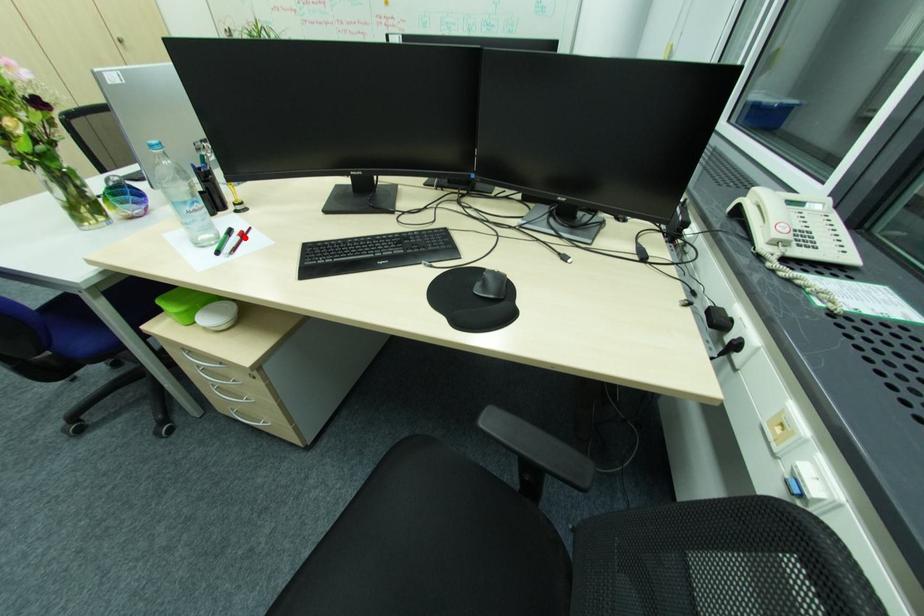
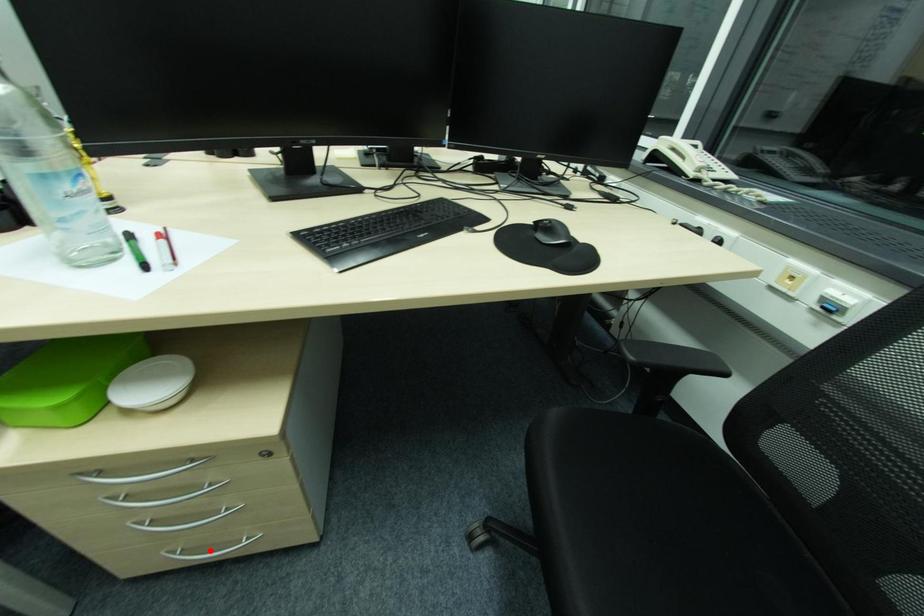
Consider the image. I am providing you with two images of the same scene from different viewpoints. A red point is marked on the first image and another point is marked on the second image. Is the marked point in image1 the same physical position as the marked point in image2?

No